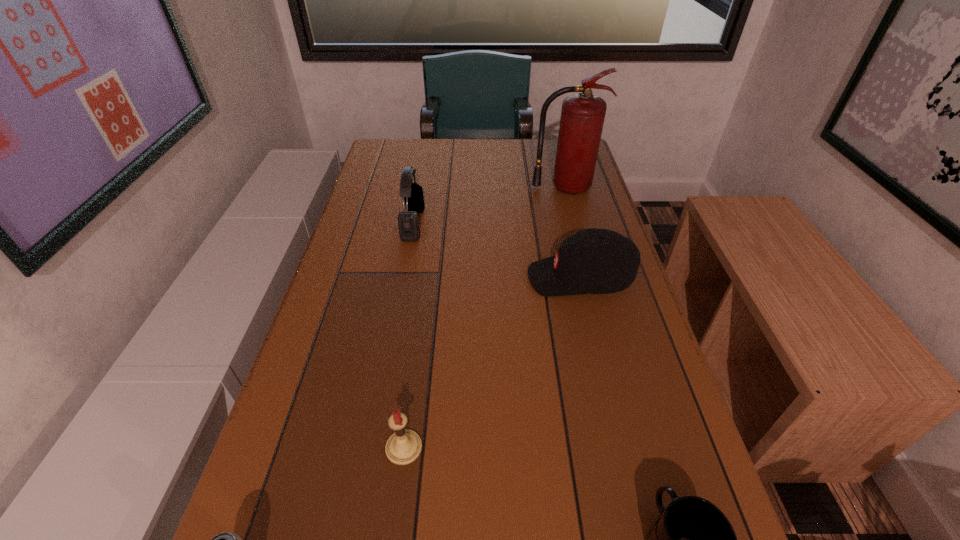
Identify the location of free space located 0.100m with a logo on the front of the third farthest object. This screenshot has height=540, width=960. (488, 278).

The width and height of the screenshot is (960, 540). I want to click on blank area located 0.090m on the front of the fourth farthest object, so click(x=395, y=522).

This screenshot has height=540, width=960. What are the coordinates of `object that is at the left edge` in the screenshot? It's located at (408, 221).

Find the location of a particular element. fire extinguisher that is at the right edge is located at coordinates (582, 118).

In order to click on baseball cap present at the right edge in this screenshot , I will do `click(593, 261)`.

In the image, there is a desktop. Where is `free space at the far edge`? The image size is (960, 540). free space at the far edge is located at coordinates (494, 166).

This screenshot has width=960, height=540. In order to click on free location at the left edge of the desktop in this screenshot , I will do `click(307, 390)`.

Locate an element on the screen. This screenshot has height=540, width=960. free space at the right edge of the desktop is located at coordinates (633, 430).

The height and width of the screenshot is (540, 960). I want to click on free space between the fifth shortest object and the farthest object, so click(489, 206).

I want to click on vacant area between the tallest object and the second tallest object, so click(489, 206).